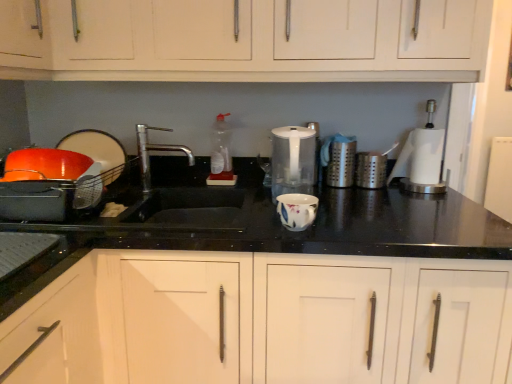
Question: From the image's perspective, does white wood cabinet at center, which is counted as the second cabinetry, starting from the top, appear lower than matte black bowl at left, which appears as the 2th appliance when viewed from the left?

Choices:
 (A) no
 (B) yes

Answer: (B)

Question: Considering the relative positions of white wood cabinet at center, which is counted as the second cabinetry, starting from the top, and matte black bowl at left, which appears as the 2th appliance when viewed from the left, in the image provided, is white wood cabinet at center, which is counted as the second cabinetry, starting from the top, to the left of matte black bowl at left, which appears as the 2th appliance when viewed from the left, from the viewer's perspective?

Choices:
 (A) no
 (B) yes

Answer: (A)

Question: Is white wood cabinet at center, which is counted as the second cabinetry, starting from the top, oriented towards matte black bowl at left, which appears as the 2th appliance when viewed from the left?

Choices:
 (A) yes
 (B) no

Answer: (B)

Question: Is white wood cabinet at center, the first cabinetry when ordered from bottom to top, thinner than matte black bowl at left, which is counted as the fourth appliance, starting from the right?

Choices:
 (A) no
 (B) yes

Answer: (A)

Question: Can you confirm if white wood cabinet at center, which is counted as the second cabinetry, starting from the top, is wider than matte black bowl at left, which is counted as the fourth appliance, starting from the right?

Choices:
 (A) no
 (B) yes

Answer: (B)

Question: Is the depth of white wood cabinet at center, the first cabinetry when ordered from bottom to top, less than that of matte black bowl at left, which appears as the 2th appliance when viewed from the left?

Choices:
 (A) no
 (B) yes

Answer: (B)

Question: Does clear plastic bottle at center appear on the right side of silver metallic faucet at center?

Choices:
 (A) yes
 (B) no

Answer: (A)

Question: Can you confirm if clear plastic bottle at center is taller than silver metallic faucet at center?

Choices:
 (A) yes
 (B) no

Answer: (A)

Question: From the image's perspective, is clear plastic bottle at center located above silver metallic faucet at center?

Choices:
 (A) yes
 (B) no

Answer: (A)

Question: From a real-world perspective, is clear plastic bottle at center positioned under silver metallic faucet at center based on gravity?

Choices:
 (A) yes
 (B) no

Answer: (B)

Question: Is clear plastic bottle at center to the left of silver metallic faucet at center from the viewer's perspective?

Choices:
 (A) no
 (B) yes

Answer: (A)

Question: Considering the relative sizes of clear plastic bottle at center and silver metallic faucet at center in the image provided, is clear plastic bottle at center shorter than silver metallic faucet at center?

Choices:
 (A) no
 (B) yes

Answer: (A)

Question: From a real-world perspective, is satin silver canister at center, the 4th appliance when ordered from left to right, on top of white matte cabinet at upper center, which is the first cabinetry from top to bottom?

Choices:
 (A) yes
 (B) no

Answer: (B)